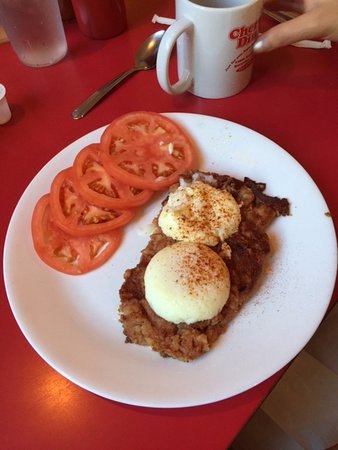
This screenshot has height=450, width=338. I want to click on floor, so 308,414.